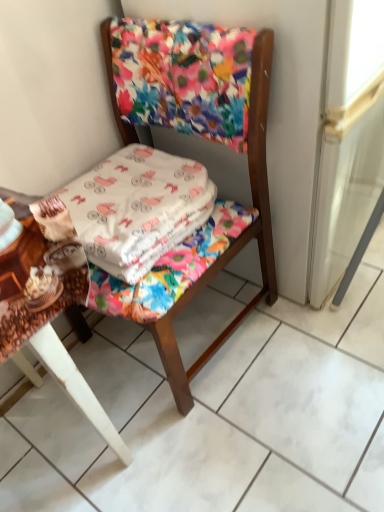
Locate an element on the screen. vacant area that lies between floral fabric screen door at upper center and floral fabric chair at center is located at coordinates (264, 345).